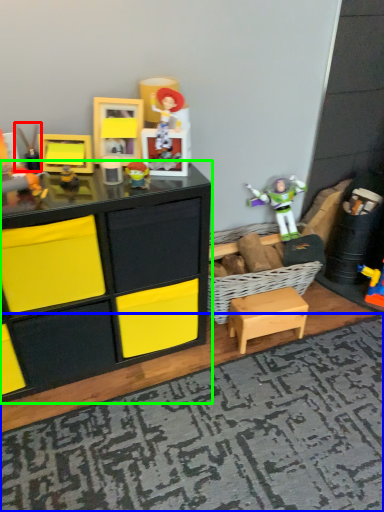
Question: Which is nearer to the toy (highlighted by a red box)? mat (highlighted by a blue box) or chest of drawers (highlighted by a green box).

Choices:
 (A) mat
 (B) chest of drawers

Answer: (B)